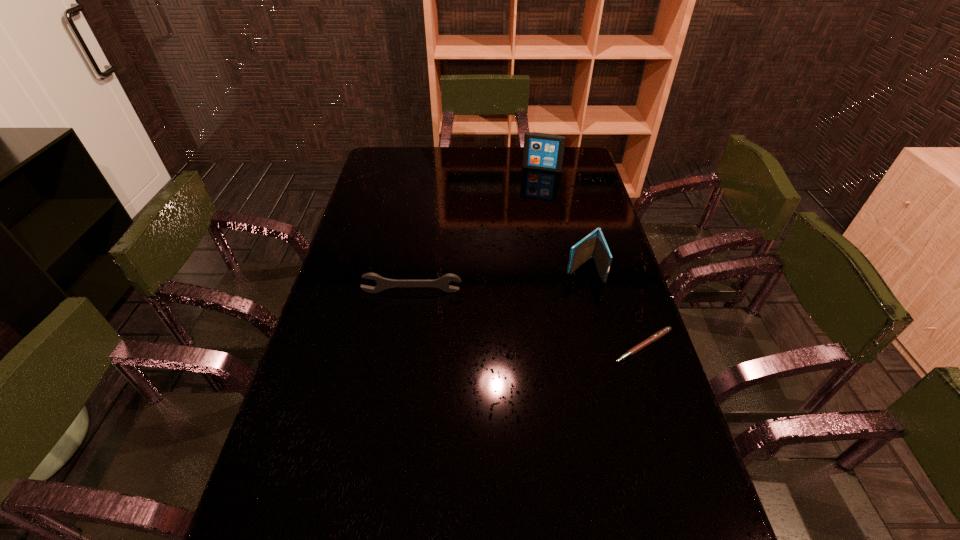
Locate an element on the screen. iPod present at the right edge is located at coordinates (542, 151).

Where is `object that is at the far right corner`? The height and width of the screenshot is (540, 960). object that is at the far right corner is located at coordinates (542, 151).

The image size is (960, 540). I want to click on vacant space at the far edge of the desktop, so click(x=456, y=165).

Identify the location of free space at the left edge. Image resolution: width=960 pixels, height=540 pixels. (319, 350).

At what (x,y) coordinates should I click in order to perform the action: click on free space at the right edge of the desktop. Please return your answer as a coordinate pair (x, y). This screenshot has width=960, height=540. Looking at the image, I should click on (605, 232).

Where is `vacant area at the far left corner`? vacant area at the far left corner is located at coordinates pos(372,165).

Find the location of a particular element. The width and height of the screenshot is (960, 540). unoccupied position between the second farthest object and the iPod is located at coordinates click(563, 219).

This screenshot has height=540, width=960. What are the coordinates of `free space between the third nearest object and the iPod` in the screenshot? It's located at (563, 219).

This screenshot has width=960, height=540. Identify the location of vacant area that lies between the nearest object and the wallet. (613, 307).

Where is `vacant space in between the wallet and the iPod`? The height and width of the screenshot is (540, 960). vacant space in between the wallet and the iPod is located at coordinates (563, 219).